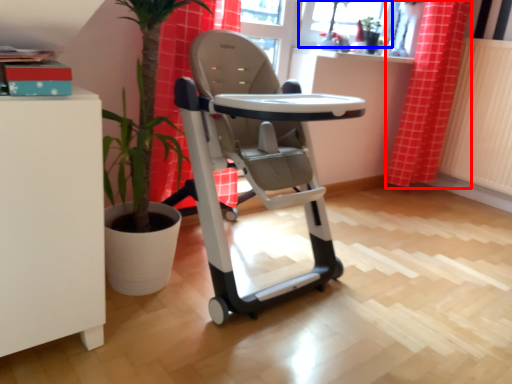
Question: Among these objects, which one is farthest to the camera, curtain (highlighted by a red box) or window screen (highlighted by a blue box)?

Choices:
 (A) curtain
 (B) window screen

Answer: (A)